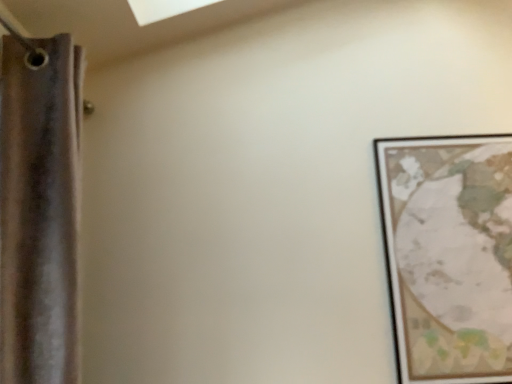
Question: In the image, is wooden framed map at right positioned in front of or behind brown fabric curtain at left?

Choices:
 (A) front
 (B) behind

Answer: (B)

Question: From a real-world perspective, is wooden framed map at right above or below brown fabric curtain at left?

Choices:
 (A) below
 (B) above

Answer: (A)

Question: Is point (403, 367) closer or farther from the camera than point (20, 374)?

Choices:
 (A) closer
 (B) farther

Answer: (B)

Question: In terms of size, does brown fabric curtain at left appear bigger or smaller than wooden framed map at right?

Choices:
 (A) small
 (B) big

Answer: (B)

Question: Visually, is brown fabric curtain at left positioned to the left or to the right of wooden framed map at right?

Choices:
 (A) left
 (B) right

Answer: (A)

Question: From their relative heights in the image, would you say brown fabric curtain at left is taller or shorter than wooden framed map at right?

Choices:
 (A) short
 (B) tall

Answer: (B)

Question: From the image's perspective, relative to wooden framed map at right, is brown fabric curtain at left above or below?

Choices:
 (A) above
 (B) below

Answer: (A)